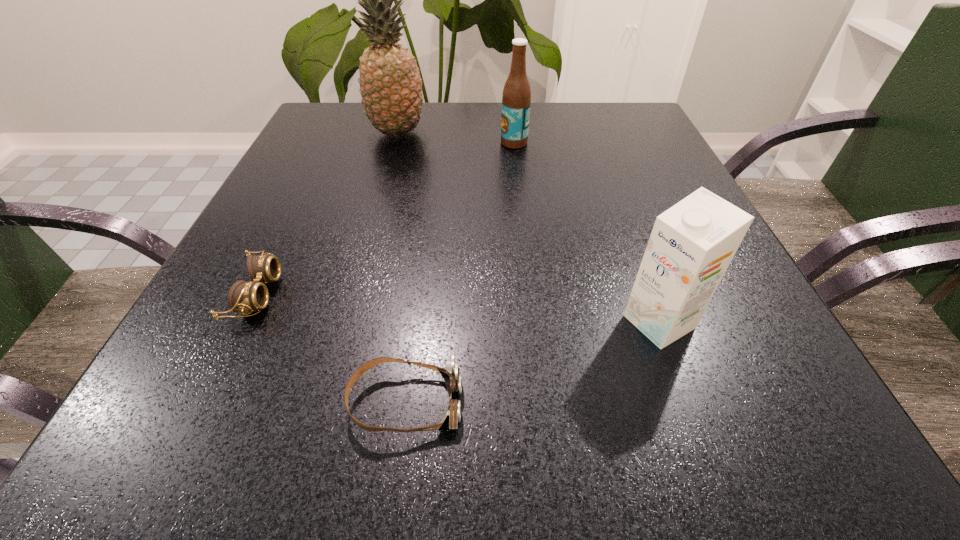
Image resolution: width=960 pixels, height=540 pixels. I want to click on free spot between the fourth object from left to right and the nearer goggles, so click(460, 273).

Image resolution: width=960 pixels, height=540 pixels. Identify the location of free area in between the tallest object and the nearer goggles. (401, 268).

You are a GUI agent. You are given a task and a screenshot of the screen. Output one action in this format:
    pyautogui.click(x=<x>, y=<y>)
    Task: Click on the vacant area that lies between the left goggles and the nearest object
    This screenshot has width=960, height=540.
    Given the screenshot: What is the action you would take?
    pyautogui.click(x=331, y=348)

Locate an element on the screen. free space that is in between the left goggles and the second object from right to left is located at coordinates (385, 218).

What are the coordinates of `free space between the nearest object and the tallest object` in the screenshot? It's located at (401, 268).

In order to click on object that is the second closest to the nearer goggles in this screenshot , I will do `click(692, 243)`.

This screenshot has width=960, height=540. Find the location of `object that is the second closest to the right goggles`. object that is the second closest to the right goggles is located at coordinates [692, 243].

This screenshot has width=960, height=540. In order to click on vacant space that satisfies the following two spatial constraints: 1. through the lenses of the rightmost object; 2. on the right side of the farther goggles in this screenshot , I will do `click(243, 322)`.

You are a GUI agent. You are given a task and a screenshot of the screen. Output one action in this format:
    pyautogui.click(x=<x>, y=<y>)
    Task: Click on the free space that satisfies the following two spatial constraints: 1. on the front side of the carton; 2. on the front-facing side of the right goggles
    
    Given the screenshot: What is the action you would take?
    pyautogui.click(x=688, y=403)

Where is `vacant space that satisfies the following two spatial constraints: 1. on the back side of the rightmost object; 2. through the lenses of the leftmost object`? Image resolution: width=960 pixels, height=540 pixels. vacant space that satisfies the following two spatial constraints: 1. on the back side of the rightmost object; 2. through the lenses of the leftmost object is located at coordinates (649, 294).